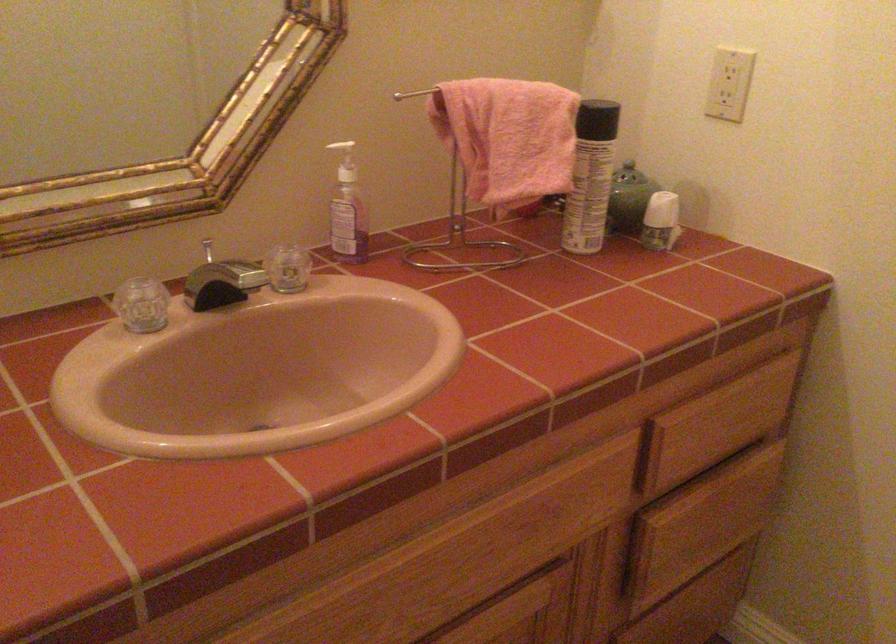
The height and width of the screenshot is (644, 896). I want to click on green jar lid, so click(x=629, y=175).